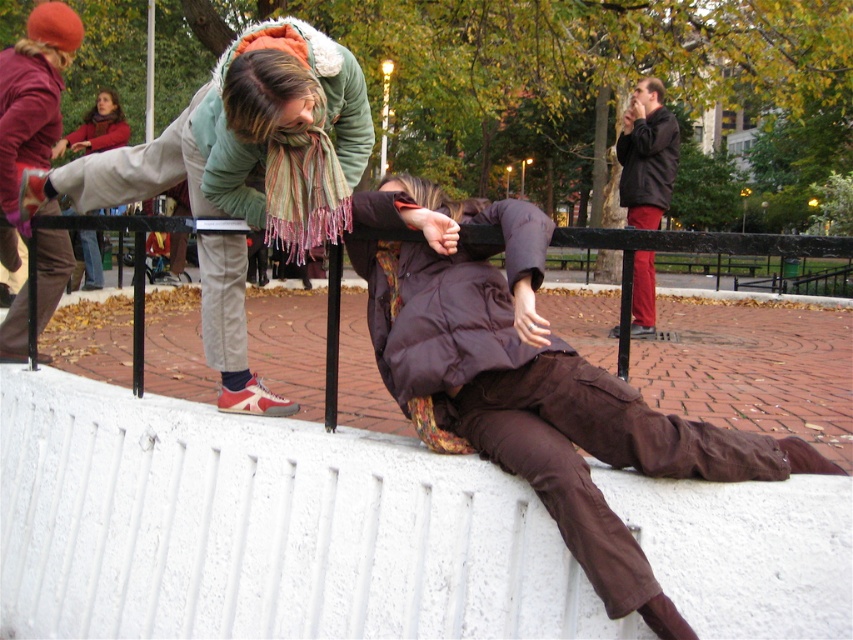
Is point (639, 125) less distant than point (115, 134)?

Yes, point (639, 125) is in front of point (115, 134).

Can you confirm if dark brown leather jacket at upper right is positioned below matte green jacket at upper left?

Yes.

The height and width of the screenshot is (640, 853). What do you see at coordinates (647, 154) in the screenshot?
I see `dark brown leather jacket at upper right` at bounding box center [647, 154].

Identify the location of dark brown leather jacket at upper right. The width and height of the screenshot is (853, 640). (647, 154).

Looking at this image, can you confirm if green fleece jacket at upper center is shorter than dark brown leather jacket at upper right?

Indeed, green fleece jacket at upper center has a lesser height compared to dark brown leather jacket at upper right.

Is point (96, 180) in front of point (645, 216)?

Yes, it is.

Locate an element on the screen. The image size is (853, 640). green fleece jacket at upper center is located at coordinates (167, 164).

Between brown matte jacket at center and green fleece jacket at upper center, which one is positioned lower?

brown matte jacket at center is lower down.

Is point (489, 280) more distant than point (181, 160)?

That is False.

The height and width of the screenshot is (640, 853). What do you see at coordinates (532, 384) in the screenshot? I see `brown matte jacket at center` at bounding box center [532, 384].

Locate an element on the screen. Image resolution: width=853 pixels, height=640 pixels. brown matte jacket at center is located at coordinates (532, 384).